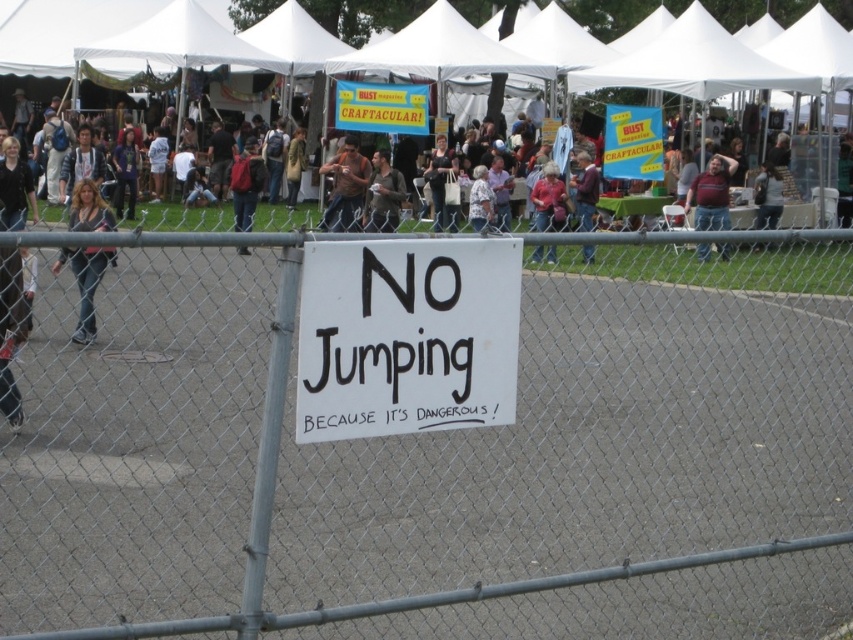
Question: Does matte brown shirt at center have a smaller size compared to red backpack at center?

Choices:
 (A) no
 (B) yes

Answer: (B)

Question: Considering the real-world distances, which object is farthest from the yellow paper sign at center?

Choices:
 (A) yellow paper sign at upper center
 (B) maroon sweater at center
 (C) matte black bag at center

Answer: (A)

Question: Which of these objects is positioned closest to the brown leather jacket at center?

Choices:
 (A) fat man in jeans at right
 (B) dark brown hair at left
 (C) maroon sweater at center
 (D) pink fabric shirt at center

Answer: (D)

Question: In this image, where is red backpack at center located relative to pink fabric shirt at center?

Choices:
 (A) left
 (B) right

Answer: (A)

Question: Which of the following is the farthest from the observer?

Choices:
 (A) (606, 150)
 (B) (424, 90)
 (C) (334, 531)

Answer: (B)

Question: Can you confirm if brown leather jacket at center is positioned above red backpack at center?

Choices:
 (A) no
 (B) yes

Answer: (B)